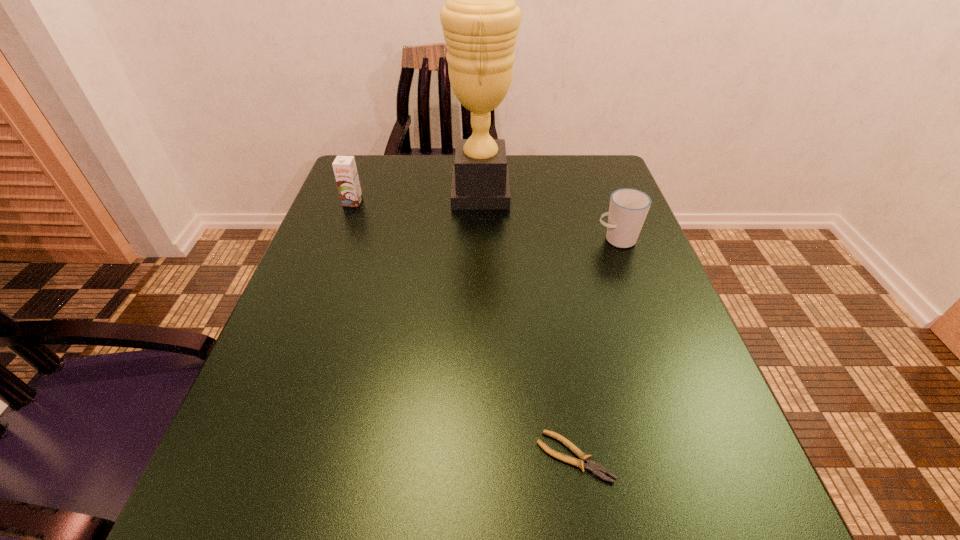
The image size is (960, 540). In order to click on vacant space located on the back of the leftmost object in this screenshot , I will do `click(368, 163)`.

What are the coordinates of `vacant space located 0.200m with a handle on the side of the second nearest object` in the screenshot? It's located at (504, 240).

The image size is (960, 540). Identify the location of vacant space situated with a handle on the side of the second nearest object. (490, 240).

What are the coordinates of `vacant space positioned with a handle on the side of the second nearest object` in the screenshot? It's located at (536, 240).

Identify the location of vacant space located on the back of the shortest object. The height and width of the screenshot is (540, 960). (543, 266).

What are the coordinates of `trophy cup positioned at the far edge` in the screenshot? It's located at (480, 19).

Where is `chocolate milk that is at the far edge`? The width and height of the screenshot is (960, 540). chocolate milk that is at the far edge is located at coordinates pos(345,170).

Where is `object at the left edge`? The width and height of the screenshot is (960, 540). object at the left edge is located at coordinates (345, 170).

Identify the location of object located at the right edge. This screenshot has width=960, height=540. (628, 208).

This screenshot has height=540, width=960. Identify the location of object that is positioned at the far left corner. 345,170.